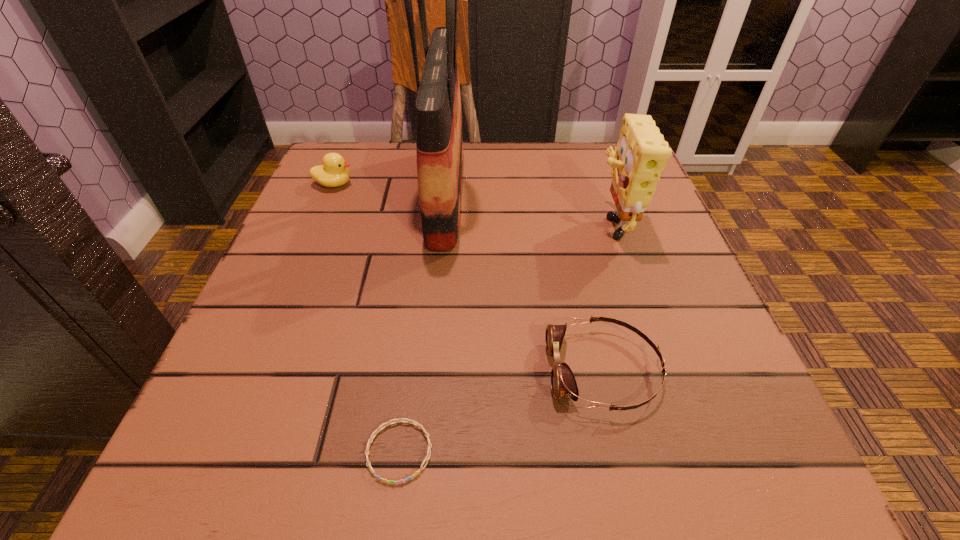
The image size is (960, 540). Find the location of `free space located 0.110m on the face of the fourth shortest object`. free space located 0.110m on the face of the fourth shortest object is located at coordinates (535, 222).

Identify the location of vacant space located on the face of the fourth shortest object. The width and height of the screenshot is (960, 540). (433, 222).

You are a GUI agent. You are given a task and a screenshot of the screen. Output one action in this format:
    pyautogui.click(x=<x>, y=<y>)
    Task: Click on the vacant area located on the beak of the duckling
    The height and width of the screenshot is (540, 960).
    Given the screenshot: What is the action you would take?
    pyautogui.click(x=377, y=184)

Find the location of `vacant space located through the lenses of the fourth farthest object`. vacant space located through the lenses of the fourth farthest object is located at coordinates (457, 370).

The image size is (960, 540). I want to click on vacant area situated through the lenses of the fourth farthest object, so click(x=275, y=370).

The height and width of the screenshot is (540, 960). What are the coordinates of `free space located 0.290m through the lenses of the fourth farthest object` in the screenshot? It's located at (345, 370).

In order to click on shopping bag that is at the far edge in this screenshot , I will do `click(439, 141)`.

Where is `sponge present at the far edge`? This screenshot has width=960, height=540. sponge present at the far edge is located at coordinates (641, 154).

The width and height of the screenshot is (960, 540). I want to click on duckling located at the far edge, so click(333, 173).

Where is `object that is positioned at the near edge`? object that is positioned at the near edge is located at coordinates (413, 422).